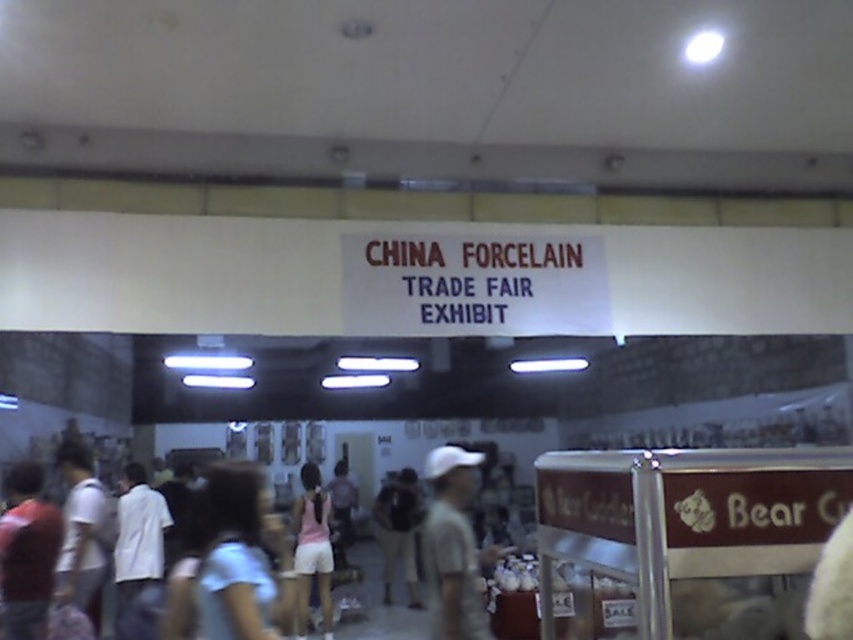
Question: Considering the relative positions of gray matte shirt at center and light brown fabric backpack at center in the image provided, where is gray matte shirt at center located with respect to light brown fabric backpack at center?

Choices:
 (A) below
 (B) above

Answer: (B)

Question: Based on their relative distances, which object is nearer to the light brown fabric backpack at center?

Choices:
 (A) matte red shirt at left
 (B) pink fabric shorts at center
 (C) white matte shirt at left
 (D) gray matte shirt at center

Answer: (B)

Question: Does white cotton shirt at center appear on the right side of light brown fabric backpack at center?

Choices:
 (A) yes
 (B) no

Answer: (B)

Question: Which object is positioned closest to the matte red shirt at left?

Choices:
 (A) white matte shirt at left
 (B) pink fabric shorts at center
 (C) light blue fabric at center
 (D) gray matte shirt at center

Answer: (A)

Question: Which object is the farthest from the matte red shirt at left?

Choices:
 (A) light blue fabric at center
 (B) white cotton shirt at center
 (C) light brown fabric backpack at center
 (D) gray matte shirt at center

Answer: (C)

Question: Can you confirm if light blue fabric at center is thinner than gray matte shirt at center?

Choices:
 (A) yes
 (B) no

Answer: (B)